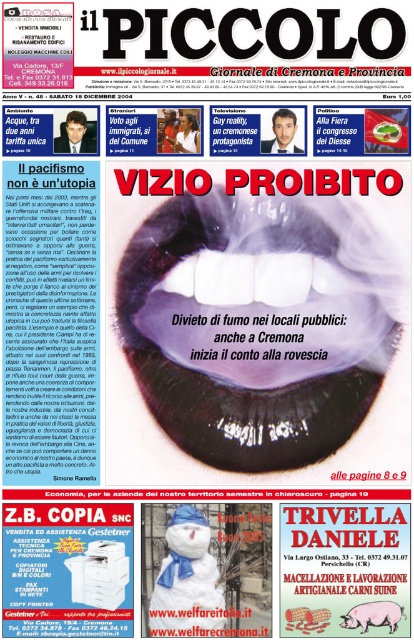
Question: Which point is farther to the camera?

Choices:
 (A) (190, 573)
 (B) (329, 387)

Answer: (B)

Question: Does white glossy teeth at center come in front of white fluffy snowman at center?

Choices:
 (A) yes
 (B) no

Answer: (B)

Question: Which of the following is the closest to the observer?

Choices:
 (A) white fluffy snowman at center
 (B) white glossy teeth at center

Answer: (A)

Question: Can you confirm if white glossy teeth at center is bigger than white fluffy snowman at center?

Choices:
 (A) no
 (B) yes

Answer: (B)

Question: Does white glossy teeth at center appear under white fluffy snowman at center?

Choices:
 (A) no
 (B) yes

Answer: (A)

Question: Which object appears closest to the camera in this image?

Choices:
 (A) white fluffy snowman at center
 (B) white glossy teeth at center

Answer: (A)